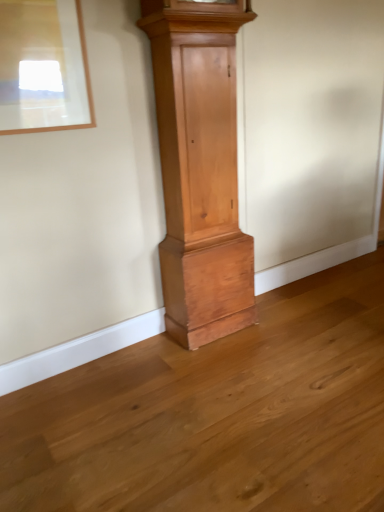
Question: Considering the relative sizes of matte wooden picture frame at upper left and natural wood grandfather clock at center in the image provided, is matte wooden picture frame at upper left smaller than natural wood grandfather clock at center?

Choices:
 (A) no
 (B) yes

Answer: (B)

Question: Is matte wooden picture frame at upper left wider than natural wood grandfather clock at center?

Choices:
 (A) no
 (B) yes

Answer: (A)

Question: From the image's perspective, is matte wooden picture frame at upper left on natural wood grandfather clock at center?

Choices:
 (A) no
 (B) yes

Answer: (B)

Question: Are matte wooden picture frame at upper left and natural wood grandfather clock at center making contact?

Choices:
 (A) no
 (B) yes

Answer: (A)

Question: Does matte wooden picture frame at upper left turn towards natural wood grandfather clock at center?

Choices:
 (A) yes
 (B) no

Answer: (B)

Question: From a real-world perspective, is matte wooden picture frame at upper left located higher than natural wood grandfather clock at center?

Choices:
 (A) yes
 (B) no

Answer: (A)

Question: Is natural wood grandfather clock at center surrounding matte wooden picture frame at upper left?

Choices:
 (A) yes
 (B) no

Answer: (B)

Question: From the image's perspective, is natural wood grandfather clock at center below matte wooden picture frame at upper left?

Choices:
 (A) yes
 (B) no

Answer: (A)

Question: Would you say natural wood grandfather clock at center is outside matte wooden picture frame at upper left?

Choices:
 (A) no
 (B) yes

Answer: (B)

Question: From a real-world perspective, is natural wood grandfather clock at center located beneath matte wooden picture frame at upper left?

Choices:
 (A) yes
 (B) no

Answer: (A)

Question: Does natural wood grandfather clock at center have a greater width compared to matte wooden picture frame at upper left?

Choices:
 (A) yes
 (B) no

Answer: (A)

Question: Does natural wood grandfather clock at center lie in front of matte wooden picture frame at upper left?

Choices:
 (A) no
 (B) yes

Answer: (A)

Question: From a real-world perspective, relative to matte wooden picture frame at upper left, is natural wood grandfather clock at center vertically above or below?

Choices:
 (A) below
 (B) above

Answer: (A)